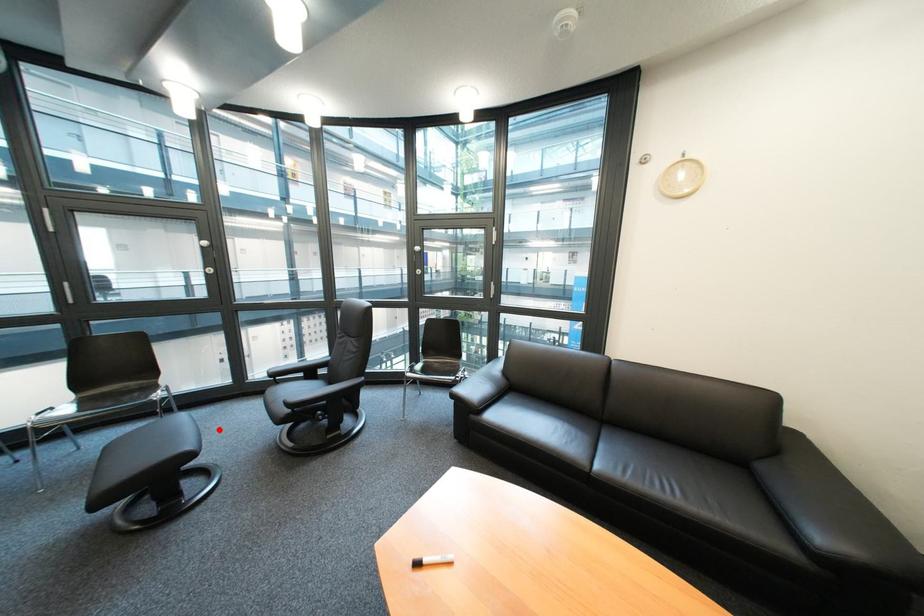
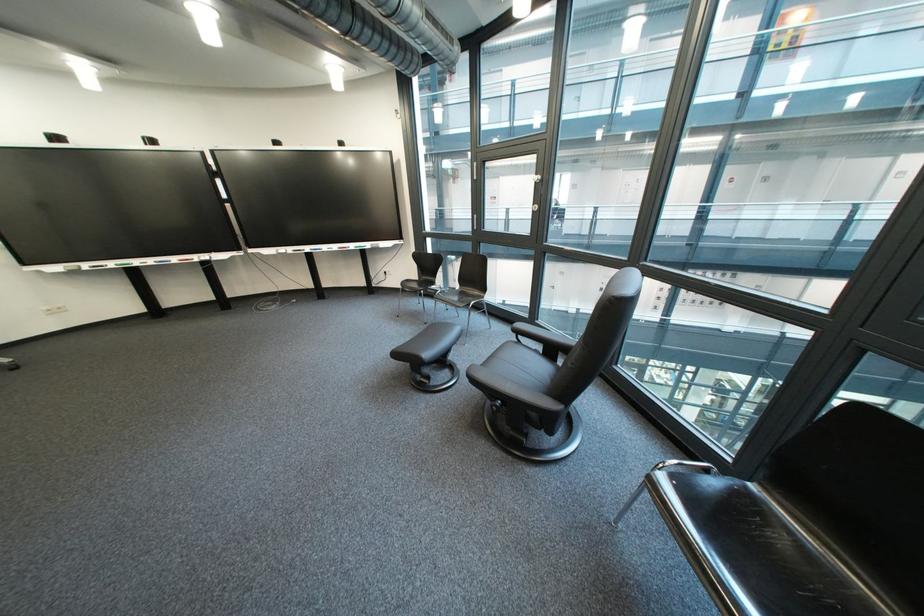
Locate, in the second image, the point that corresponds to the highlighted location in the first image.

(505, 344)